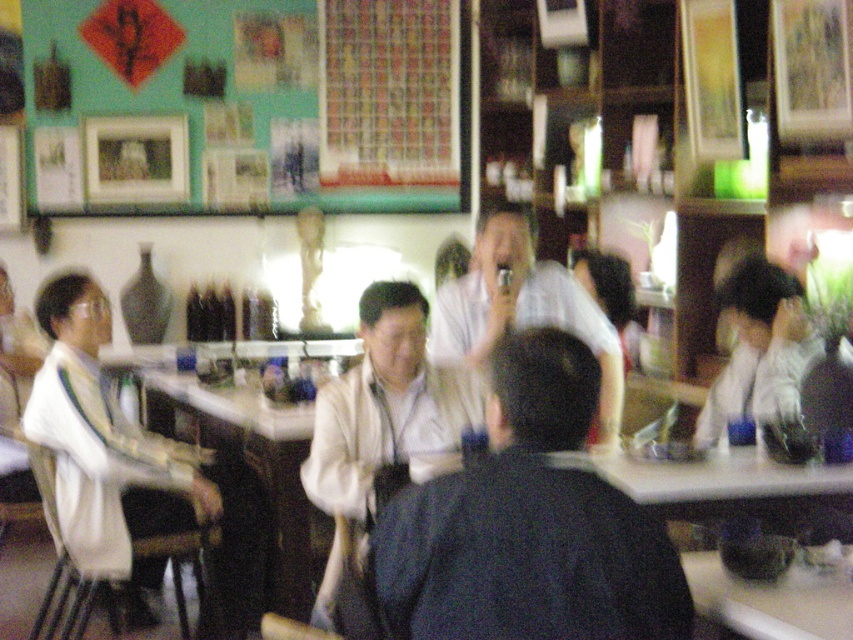
Based on the photo, does white matte jacket at center have a greater width compared to white glossy shirt at center?

In fact, white matte jacket at center might be narrower than white glossy shirt at center.

Does white matte jacket at center appear on the left side of white glossy shirt at center?

Yes, white matte jacket at center is to the left of white glossy shirt at center.

Between point (378, 444) and point (477, 316), which one is positioned behind?

Point (477, 316)

Find the location of `white matte jacket at center`. white matte jacket at center is located at coordinates (381, 417).

In the scene shown: How far apart are white matte shirt at left and white glossy table at lower right?

They are 2.07 meters apart.

Consider the image. Does white matte shirt at left appear under white glossy table at lower right?

Actually, white matte shirt at left is above white glossy table at lower right.

Is point (90, 524) farther from viewer compared to point (734, 608)?

Yes, point (90, 524) is farther from viewer.

Where is `white matte shirt at left`? white matte shirt at left is located at coordinates click(103, 451).

What do you see at coordinates (381, 417) in the screenshot? The height and width of the screenshot is (640, 853). I see `white matte jacket at center` at bounding box center [381, 417].

Is white matte jacket at center to the right of white glossy table at lower right from the viewer's perspective?

Incorrect, white matte jacket at center is not on the right side of white glossy table at lower right.

Is point (415, 412) positioned after point (706, 572)?

Yes, it is behind point (706, 572).

Identify the location of white matte jacket at center. Image resolution: width=853 pixels, height=640 pixels. (381, 417).